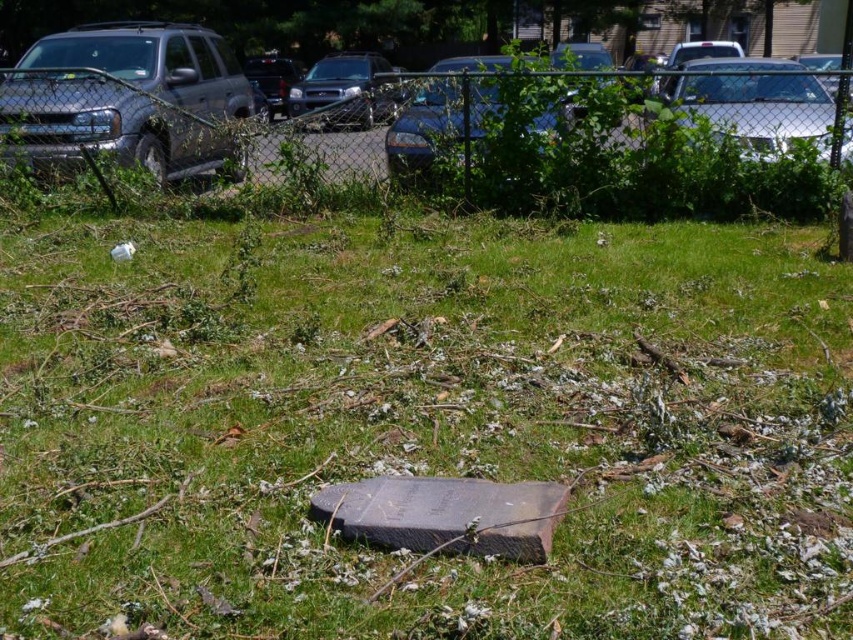
You are standing in the grassy area and want to walk to the parking lot behind the chain link fence. You see the brushed metal truck at left and the metallic silver car at center. Which vehicle is closer to you?

The brushed metal truck at left is closer to you because it is further to the viewer than the metallic silver car at center, meaning it is positioned in front of the other vehicle.